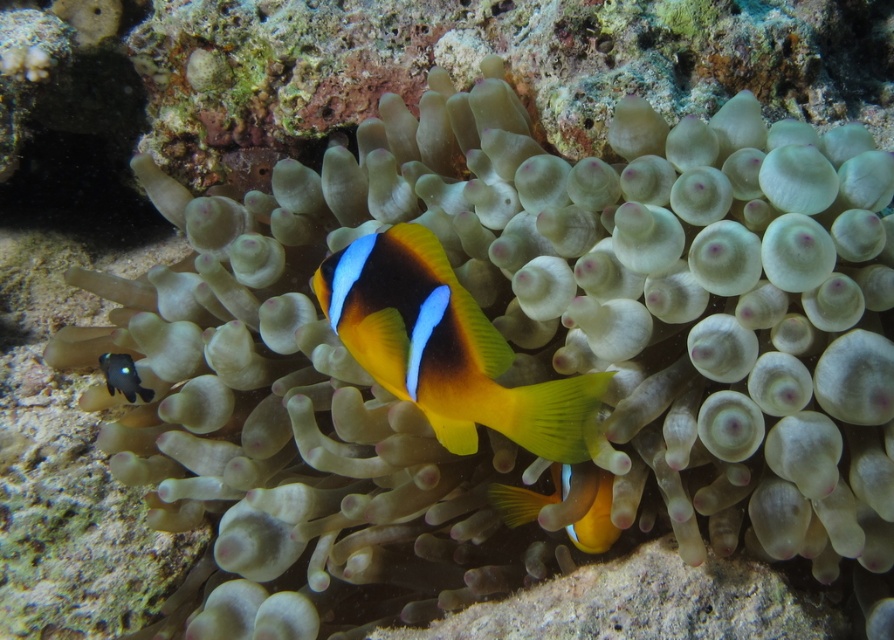
You are an underwater photographer aiming to capture both the shiny orange clownfish at center and the yellow matte clownfish at center in a single frame. Given their sizes, which clownfish will appear larger in your photo?

The shiny orange clownfish at center will appear larger in the photo because its width is larger than the yellow matte clownfish at center.

You are a marine biologist observing the underwater scene. You notice the shiny orange clownfish at center and the shiny black rock at lower left. Which object is positioned higher in the image?

The shiny orange clownfish at center is located above the shiny black rock at lower left, so it is positioned higher in the image.